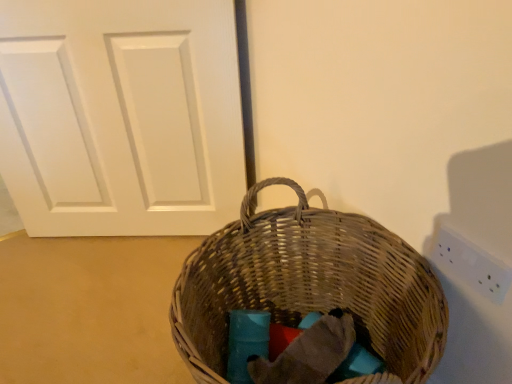
The height and width of the screenshot is (384, 512). What are the coordinates of `free spot in front of white matte door at center` in the screenshot? It's located at (105, 298).